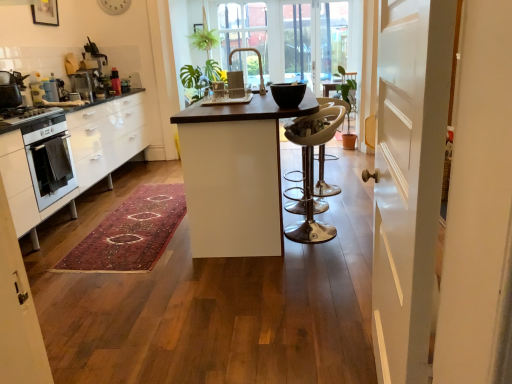
Question: From the image's perspective, is metallic silver coffee machine at left, the fourth appliance when ordered from right to left, beneath metallic silver coffee machine at upper left, which is the first appliance in top-to-bottom order?

Choices:
 (A) yes
 (B) no

Answer: (A)

Question: Is metallic silver coffee machine at left, which ranks as the second appliance in front-to-back order, placed right next to metallic silver coffee machine at upper left, the 3th appliance when ordered from right to left?

Choices:
 (A) yes
 (B) no

Answer: (B)

Question: Is metallic silver coffee machine at left, which ranks as the third appliance in top-to-bottom order, bigger than metallic silver coffee machine at upper left, which is the 1th appliance from back to front?

Choices:
 (A) yes
 (B) no

Answer: (B)

Question: Is metallic silver coffee machine at left, which ranks as the second appliance in bottom-to-top order, looking in the opposite direction of metallic silver coffee machine at upper left, the fourth appliance when ordered from front to back?

Choices:
 (A) no
 (B) yes

Answer: (A)

Question: Is metallic silver coffee machine at upper left, the 3th appliance when ordered from right to left, inside metallic silver coffee machine at left, positioned as the third appliance in back-to-front order?

Choices:
 (A) no
 (B) yes

Answer: (A)

Question: In terms of height, does clear glass window at center look taller or shorter compared to black glossy bowl at center, which is the fourth appliance in left-to-right order?

Choices:
 (A) tall
 (B) short

Answer: (A)

Question: Does point (262, 8) appear closer or farther from the camera than point (289, 104)?

Choices:
 (A) closer
 (B) farther

Answer: (B)

Question: In terms of size, does clear glass window at center appear bigger or smaller than black glossy bowl at center, which is the 1th appliance in bottom-to-top order?

Choices:
 (A) small
 (B) big

Answer: (B)

Question: In the image, is clear glass window at center on the left side or the right side of black glossy bowl at center, the 4th appliance positioned from the back?

Choices:
 (A) right
 (B) left

Answer: (B)

Question: In terms of height, does metallic silver bar stool at center look taller or shorter compared to white glossy cabinets at left?

Choices:
 (A) short
 (B) tall

Answer: (A)

Question: In the image, is metallic silver bar stool at center positioned in front of or behind white glossy cabinets at left?

Choices:
 (A) behind
 (B) front

Answer: (A)

Question: From a real-world perspective, relative to white glossy cabinets at left, is metallic silver bar stool at center vertically above or below?

Choices:
 (A) above
 (B) below

Answer: (B)

Question: Is metallic silver bar stool at center inside or outside of white glossy cabinets at left?

Choices:
 (A) inside
 (B) outside

Answer: (B)

Question: In the image, is metallic silver coffee machine at upper left, which is the 1th appliance from back to front, positioned in front of or behind black glossy bowl at center, positioned as the first appliance in front-to-back order?

Choices:
 (A) front
 (B) behind

Answer: (B)

Question: In terms of size, does metallic silver coffee machine at upper left, which is the first appliance in top-to-bottom order, appear bigger or smaller than black glossy bowl at center, which is the fourth appliance in left-to-right order?

Choices:
 (A) big
 (B) small

Answer: (A)